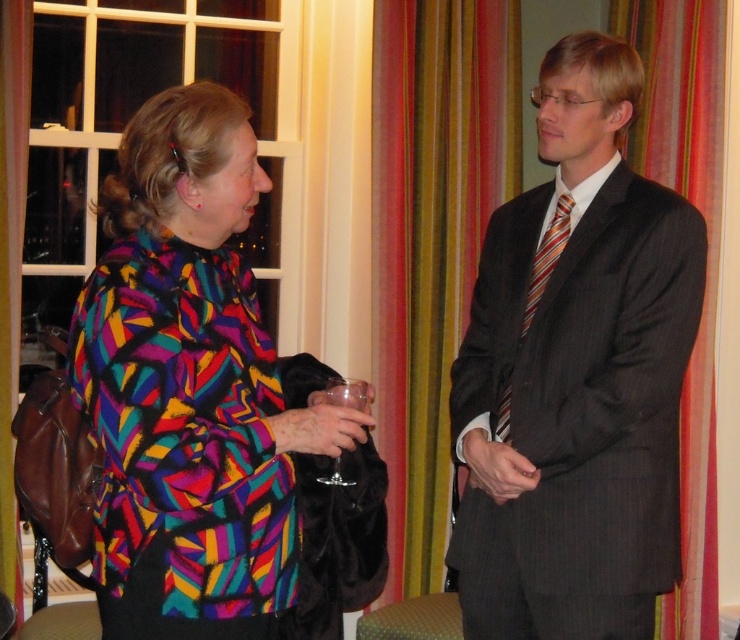
You are a tailor who needs to determine which object is wider between the multicolored fabric coat at left and the silky orange curtain at right. Based on the scene, can you tell which one is wider?

The multicolored fabric coat at left is wider than the silky orange curtain at right according to the description.